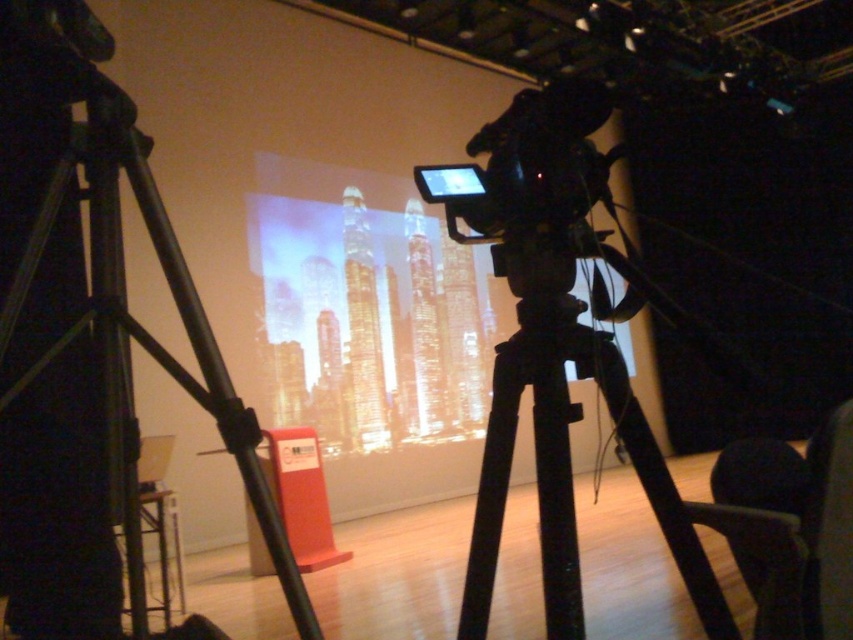
Question: Is black metal tripod at left bigger than black plastic camera at center?

Choices:
 (A) no
 (B) yes

Answer: (B)

Question: Based on their relative distances, which object is nearer to the black metal tripod at left?

Choices:
 (A) black plastic camera at center
 (B) black matte tripod at center

Answer: (B)

Question: Is black matte tripod at center to the right of black plastic camera at center from the viewer's perspective?

Choices:
 (A) no
 (B) yes

Answer: (B)

Question: Does matte glass screen at center have a greater width compared to black plastic camera at center?

Choices:
 (A) no
 (B) yes

Answer: (B)

Question: Which point appears closest to the camera in this image?

Choices:
 (A) (293, 609)
 (B) (469, 164)
 (C) (451, 371)

Answer: (A)

Question: Which of the following is the closest to the observer?

Choices:
 (A) (364, 371)
 (B) (149, 218)
 (C) (553, 525)

Answer: (C)